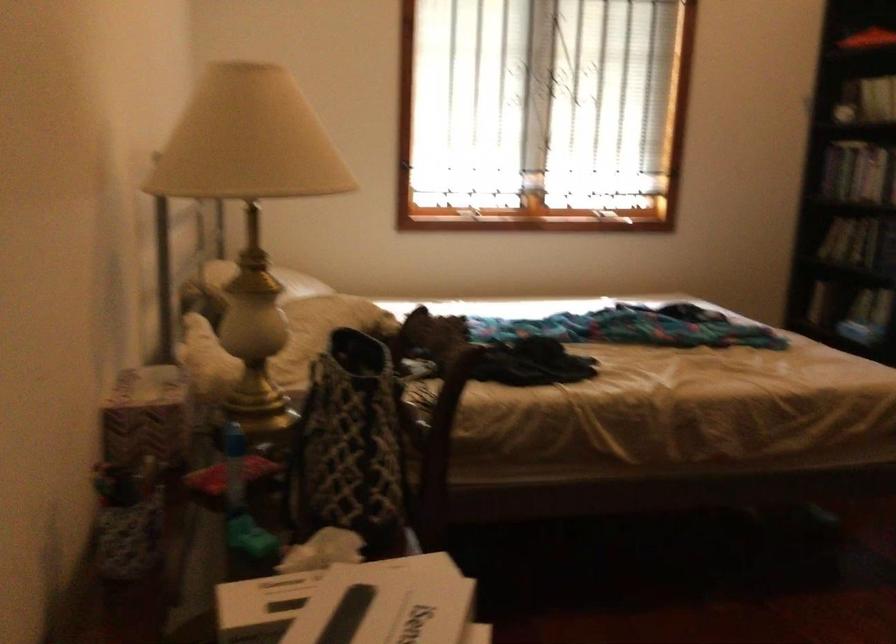
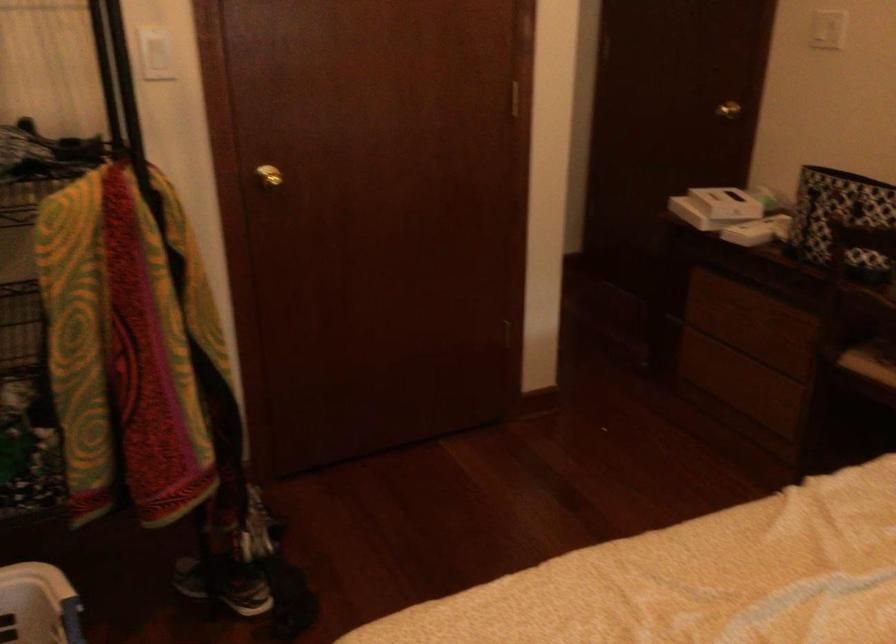
Find the pixel in the second image that matches pixel 461 346 in the first image.

(840, 218)